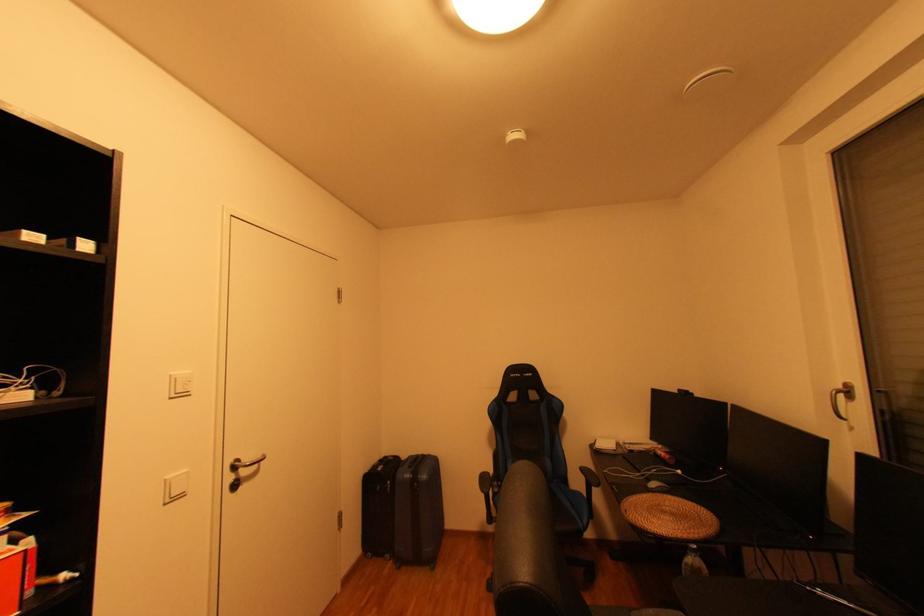
Identify the location of window handle. This screenshot has width=924, height=616. (841, 399).